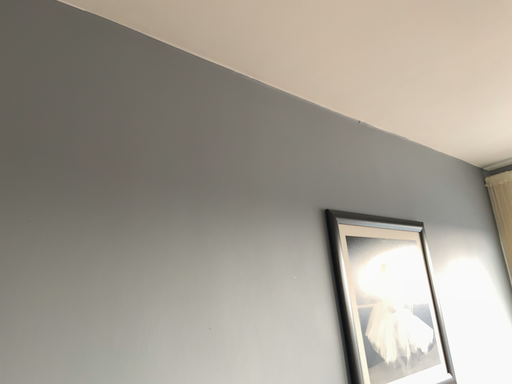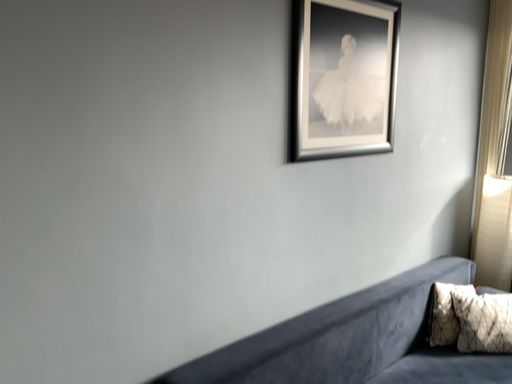
Question: Which way did the camera rotate in the video?

Choices:
 (A) rotated upward
 (B) rotated downward

Answer: (B)